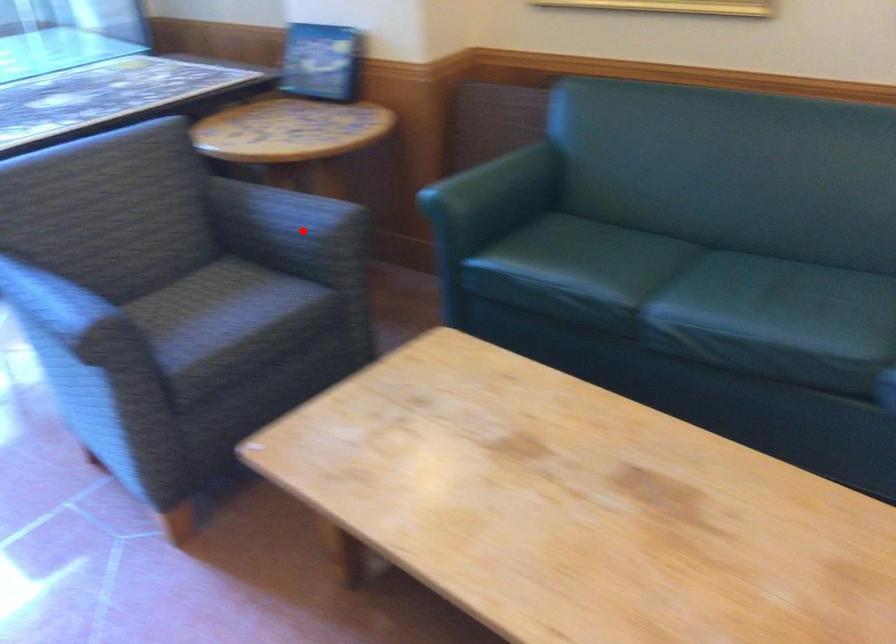
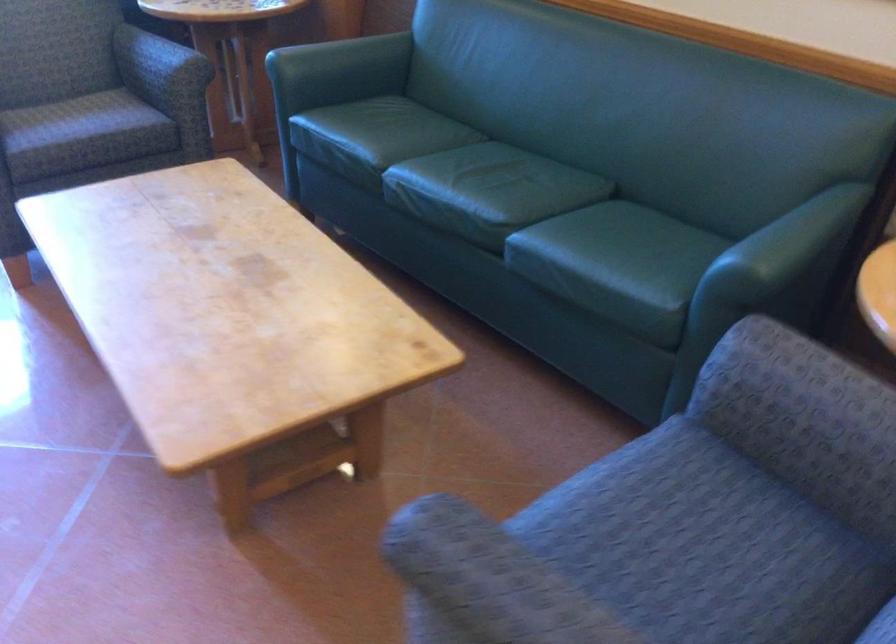
Question: I am providing you with two images of the same scene from different viewpoints. In image1, a red point is highlighted. Considering the same 3D point in image2, which of the following is correct?

Choices:
 (A) It is closer
 (B) It is farther

Answer: (B)